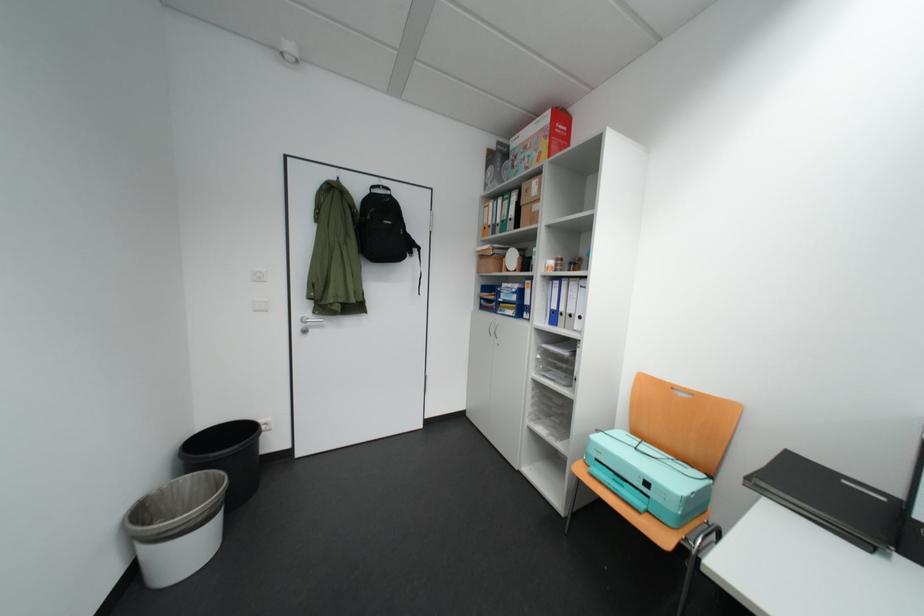
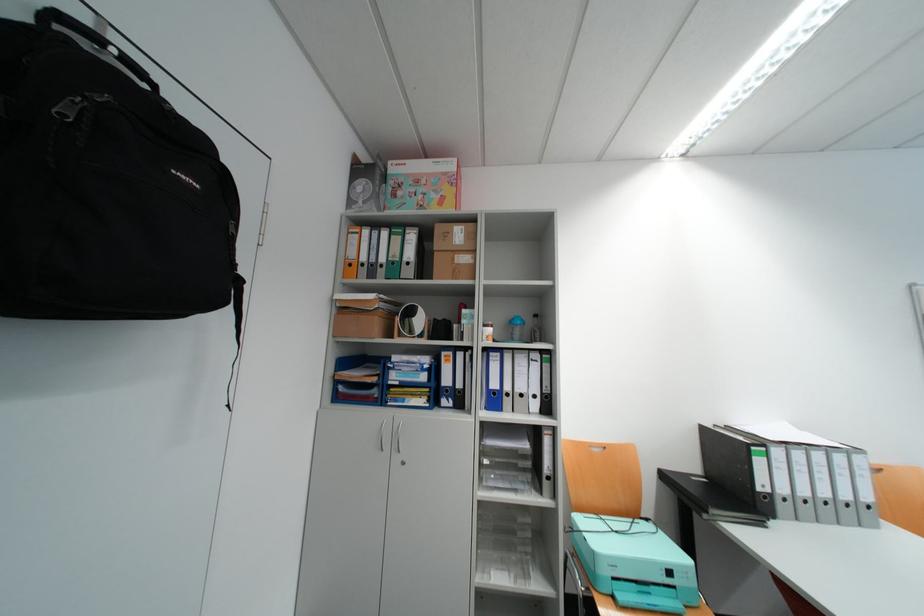
Where in the second image is the point corresponding to (x=659, y=485) from the first image?

(682, 573)